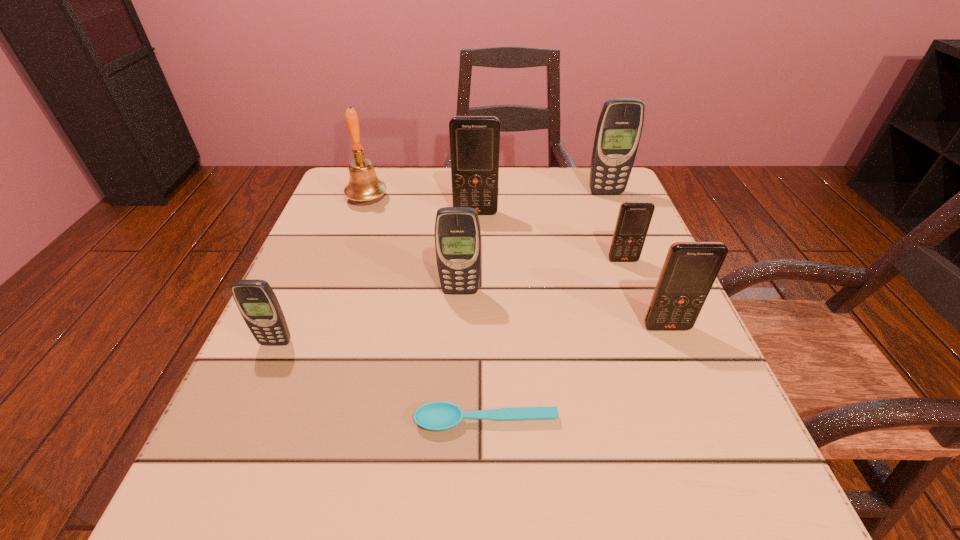
Select which object appears as the fourth closest to the third nearest object. Please provide its 2D coordinates. Your answer should be formatted as a tuple, i.e. [(x, y)], where the tuple contains the x and y coordinates of a point satisfying the conditions above.

[(474, 140)]

Select which object is the second closest to the farthest cellular telephone. Please provide its 2D coordinates. Your answer should be formatted as a tuple, i.e. [(x, y)], where the tuple contains the x and y coordinates of a point satisfying the conditions above.

[(634, 218)]

This screenshot has width=960, height=540. What are the coordinates of `the fifth closest cellular telephone to the leftmost gray cellular telephone` in the screenshot? It's located at (619, 128).

Identify which cellular telephone is located as the third nearest to the third farthest cellular telephone. Please provide its 2D coordinates. Your answer should be formatted as a tuple, i.e. [(x, y)], where the tuple contains the x and y coordinates of a point satisfying the conditions above.

[(474, 140)]

Identify which orange cellular telephone is located as the third nearest to the spoon. Please provide its 2D coordinates. Your answer should be formatted as a tuple, i.e. [(x, y)], where the tuple contains the x and y coordinates of a point satisfying the conditions above.

[(474, 140)]

In order to click on orange cellular telephone that is the third closest to the fifth farthest object in this screenshot , I will do 690,268.

Image resolution: width=960 pixels, height=540 pixels. Find the location of `gray cellular telephone that is the second closest to the bell`. gray cellular telephone that is the second closest to the bell is located at coordinates (255, 299).

Where is `gray cellular telephone that can be found as the third closest to the second smallest orange cellular telephone`? gray cellular telephone that can be found as the third closest to the second smallest orange cellular telephone is located at coordinates [x=255, y=299].

Identify the location of free space that satisfies the following two spatial constraints: 1. on the screen of the seventh farthest object; 2. on the left side of the shortest object. The height and width of the screenshot is (540, 960). (241, 422).